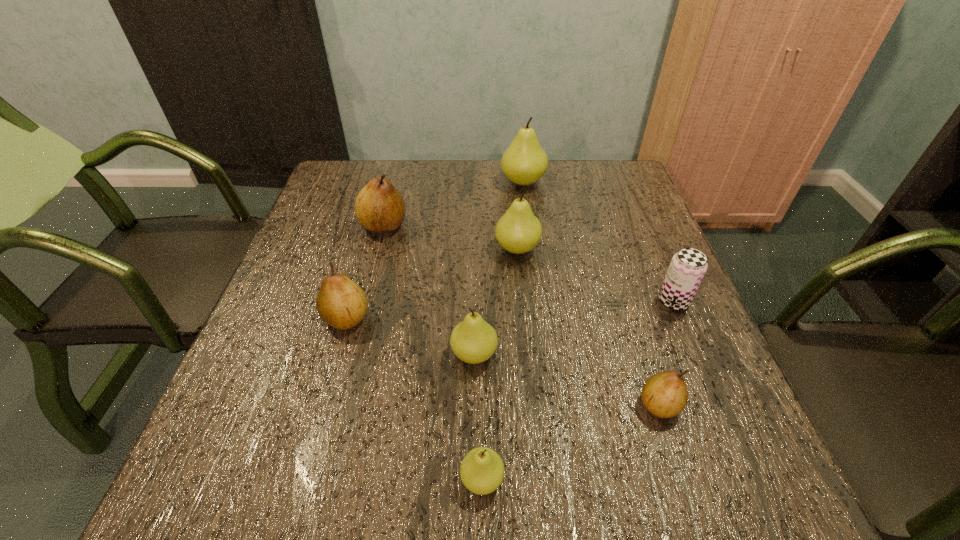
At what (x,y) coordinates should I click in order to perform the action: click on object that is at the far edge. Please return your answer as a coordinate pair (x, y). This screenshot has width=960, height=540. Looking at the image, I should click on (524, 162).

In order to click on object located at the near edge in this screenshot , I will do `click(482, 470)`.

Where is `beer can that is at the right edge`? The width and height of the screenshot is (960, 540). beer can that is at the right edge is located at coordinates (688, 266).

This screenshot has width=960, height=540. What are the coordinates of `pear present at the right edge` in the screenshot? It's located at (664, 394).

The height and width of the screenshot is (540, 960). Find the location of `vacant space at the far edge of the desktop`. vacant space at the far edge of the desktop is located at coordinates (503, 177).

Locate an element on the screen. This screenshot has width=960, height=540. vacant space at the near edge is located at coordinates (315, 463).

This screenshot has width=960, height=540. In the image, there is a desktop. In order to click on free region at the left edge in this screenshot , I will do `click(344, 220)`.

Where is `free space at the right edge`? Image resolution: width=960 pixels, height=540 pixels. free space at the right edge is located at coordinates (645, 326).

The width and height of the screenshot is (960, 540). In the image, there is a desktop. In order to click on blank space at the far left corner in this screenshot , I will do `click(356, 186)`.

Find the location of a particular element. The width and height of the screenshot is (960, 540). free space at the far right corner is located at coordinates (580, 160).